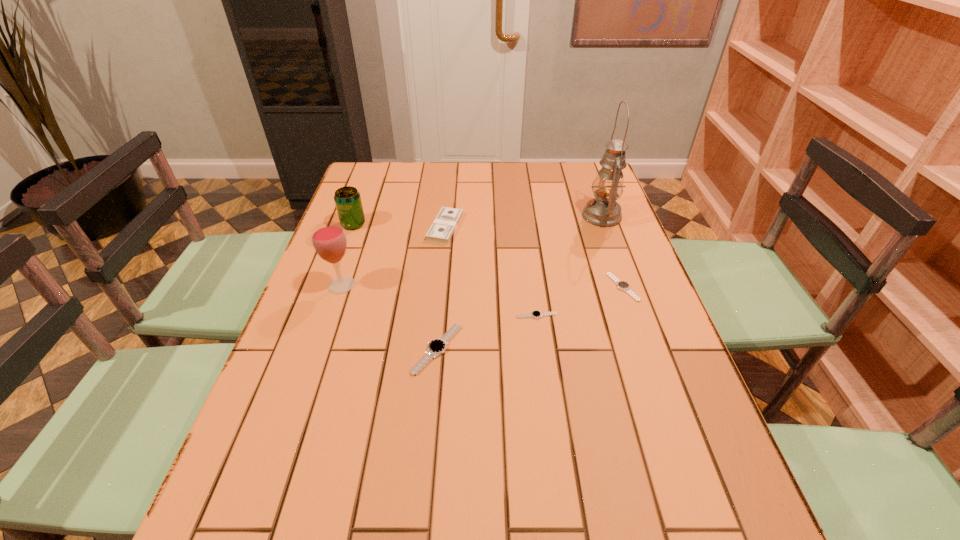
I want to click on free area in between the oil lamp and the nearest object, so click(x=519, y=282).

Find the location of a particular element. Image resolution: width=960 pixels, height=540 pixels. empty location between the oil lamp and the beer can is located at coordinates (477, 220).

Find the location of a particular element. This screenshot has height=540, width=960. free space between the oil lamp and the fourth tallest object is located at coordinates (523, 221).

The width and height of the screenshot is (960, 540). I want to click on vacant region between the third shortest object and the fourth tallest object, so click(442, 288).

Where is `free space between the beer can and the second shortest watch`? This screenshot has width=960, height=540. free space between the beer can and the second shortest watch is located at coordinates (488, 255).

At what (x,y) coordinates should I click in order to perform the action: click on vacant space in between the tallest object and the fourth shortest object. Please return your answer as a coordinate pair (x, y). The height and width of the screenshot is (540, 960). Looking at the image, I should click on (523, 221).

Image resolution: width=960 pixels, height=540 pixels. Find the location of `blank region between the fourth shortest object and the tallest object`. blank region between the fourth shortest object and the tallest object is located at coordinates (523, 221).

Identify the location of object that stands as the third closest to the second shortest object. This screenshot has height=540, width=960. (436, 347).

Locate which object is the closest to the second watch from right to left. Please provide its 2D coordinates. Your answer should be formatted as a tuple, i.e. [(x, y)], where the tuple contains the x and y coordinates of a point satisfying the conditions above.

[(436, 347)]

Where is `watch object that ranks as the closest to the tallest object`? watch object that ranks as the closest to the tallest object is located at coordinates (622, 285).